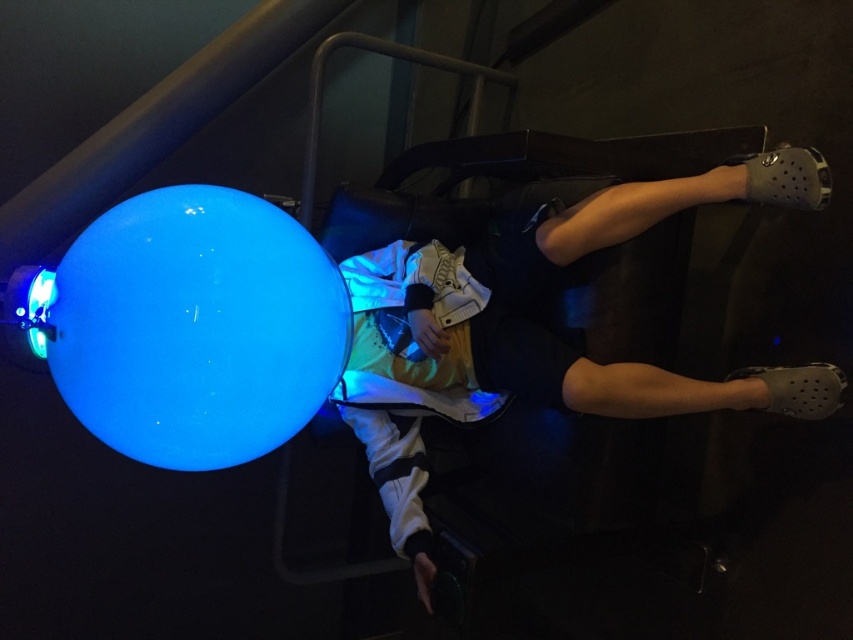
Does white fabric pants at center have a smaller size compared to glossy blue sphere at center?

No, white fabric pants at center is not smaller than glossy blue sphere at center.

Can you confirm if white fabric pants at center is thinner than glossy blue sphere at center?

Incorrect, white fabric pants at center's width is not less than glossy blue sphere at center's.

Image resolution: width=853 pixels, height=640 pixels. Describe the element at coordinates (538, 324) in the screenshot. I see `white fabric pants at center` at that location.

Locate an element on the screen. white fabric pants at center is located at coordinates pos(538,324).